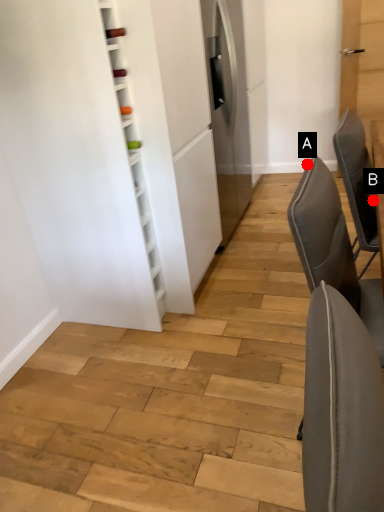
Question: Two points are circled on the image, labeled by A and B beside each circle. Which point is farther from the camera taking this photo?

Choices:
 (A) A is further
 (B) B is further

Answer: (B)